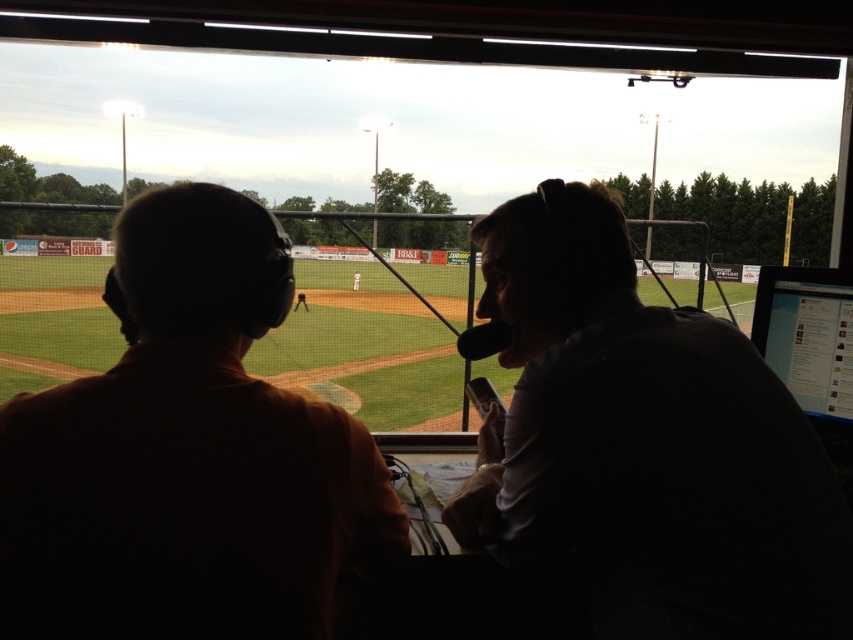
What do you see at coordinates (187, 454) in the screenshot? I see `orange cotton shirt at left` at bounding box center [187, 454].

Between point (248, 202) and point (805, 410), which one is positioned in front?

Point (248, 202) is more forward.

Locate an element on the screen. The image size is (853, 640). orange cotton shirt at left is located at coordinates (187, 454).

Who is positioned more to the right, orange cotton shirt at left or silhouette shirt at right?

silhouette shirt at right is more to the right.

Is point (230, 275) behind point (654, 595)?

No, (230, 275) is in front of (654, 595).

Where is `orange cotton shirt at left`? This screenshot has width=853, height=640. orange cotton shirt at left is located at coordinates 187,454.

Image resolution: width=853 pixels, height=640 pixels. Describe the element at coordinates (645, 445) in the screenshot. I see `silhouette shirt at right` at that location.

Who is taller, silhouette shirt at right or black glossy monitor at right?

Standing taller between the two is silhouette shirt at right.

You are a GUI agent. You are given a task and a screenshot of the screen. Output one action in this format:
    pyautogui.click(x=<x>, y=<y>)
    Task: Click on the silhouette shirt at right
    This screenshot has width=853, height=640.
    Given the screenshot: What is the action you would take?
    pyautogui.click(x=645, y=445)